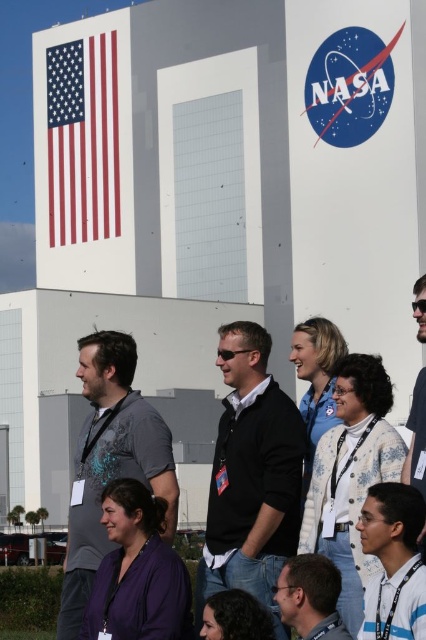
Which is behind, point (135, 477) or point (100, 164)?

Positioned behind is point (100, 164).

Between point (152, 460) and point (77, 72), which one is positioned in front?

Point (152, 460)

Is point (94, 420) less distant than point (81, 125)?

Yes, point (94, 420) is closer to viewer.

Locate an element on the screen. The width and height of the screenshot is (426, 640). gray t-shirt at center is located at coordinates (109, 464).

Can you confirm if black matte jacket at center is positioned to the right of red-white-and-blue fabric flag at upper left?

Yes, black matte jacket at center is to the right of red-white-and-blue fabric flag at upper left.

Can you confirm if black matte jacket at center is positioned to the left of red-white-and-blue fabric flag at upper left?

In fact, black matte jacket at center is to the right of red-white-and-blue fabric flag at upper left.

Image resolution: width=426 pixels, height=640 pixels. What do you see at coordinates (252, 476) in the screenshot?
I see `black matte jacket at center` at bounding box center [252, 476].

What are the coordinates of `black matte jacket at center` in the screenshot? It's located at (252, 476).

Can you confirm if black matte jacket at center is wider than gray t-shirt at center?

No.

Describe the element at coordinates (252, 476) in the screenshot. I see `black matte jacket at center` at that location.

Locate an element on the screen. The height and width of the screenshot is (640, 426). black matte jacket at center is located at coordinates (252, 476).